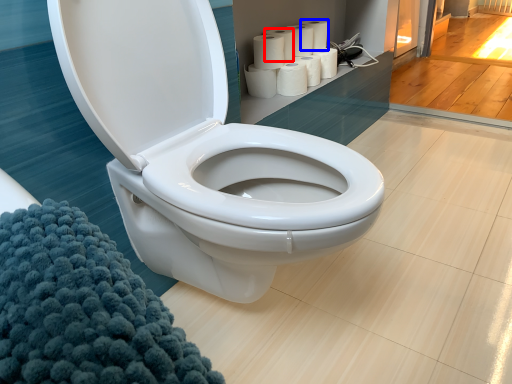
Question: Which of the following is the farthest to the observer, paper towel (highlighted by a red box) or toilet paper (highlighted by a blue box)?

Choices:
 (A) paper towel
 (B) toilet paper

Answer: (B)